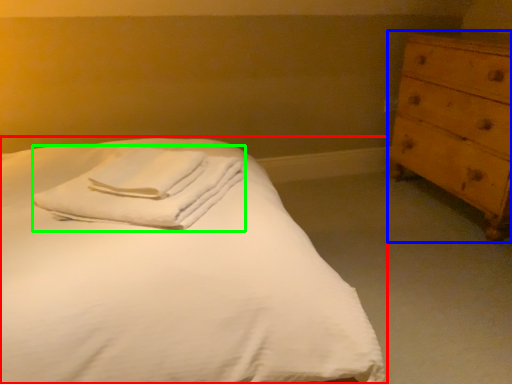
Question: Estimate the real-world distances between objects in this image. Which object is closer to bed (highlighted by a red box), chest of drawers (highlighted by a blue box) or material (highlighted by a green box)?

Choices:
 (A) chest of drawers
 (B) material

Answer: (B)